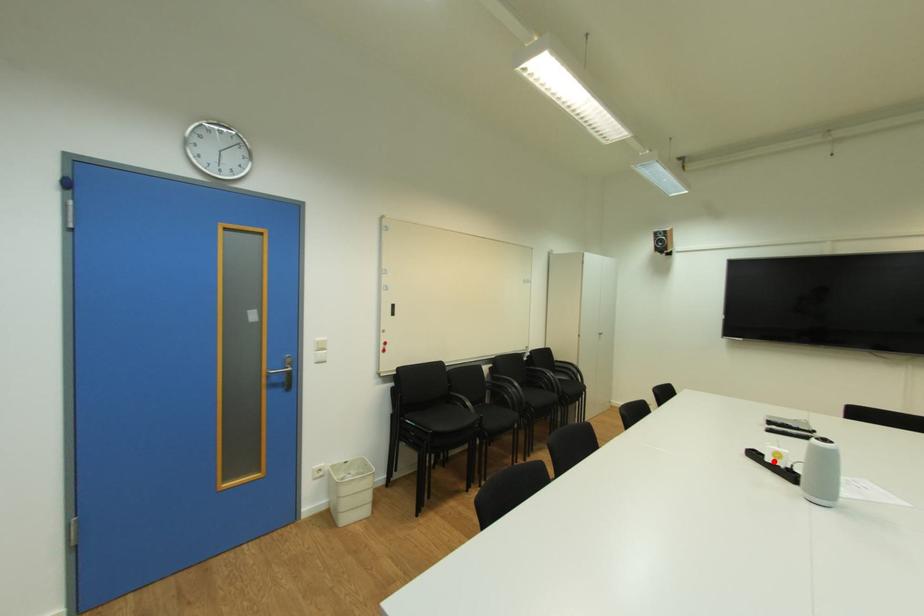
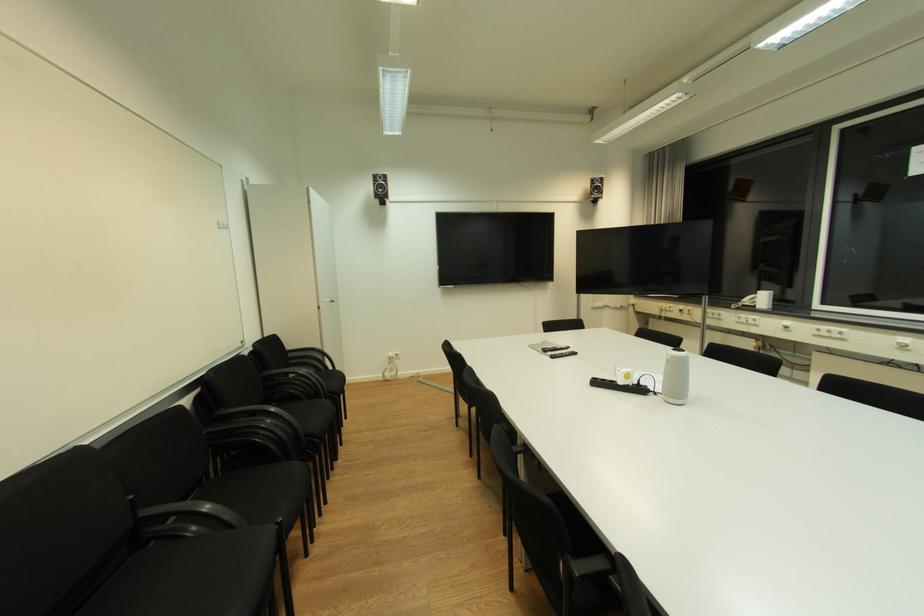
Where in the second image is the point corresponding to the highlighted location from the first image?

(626, 384)